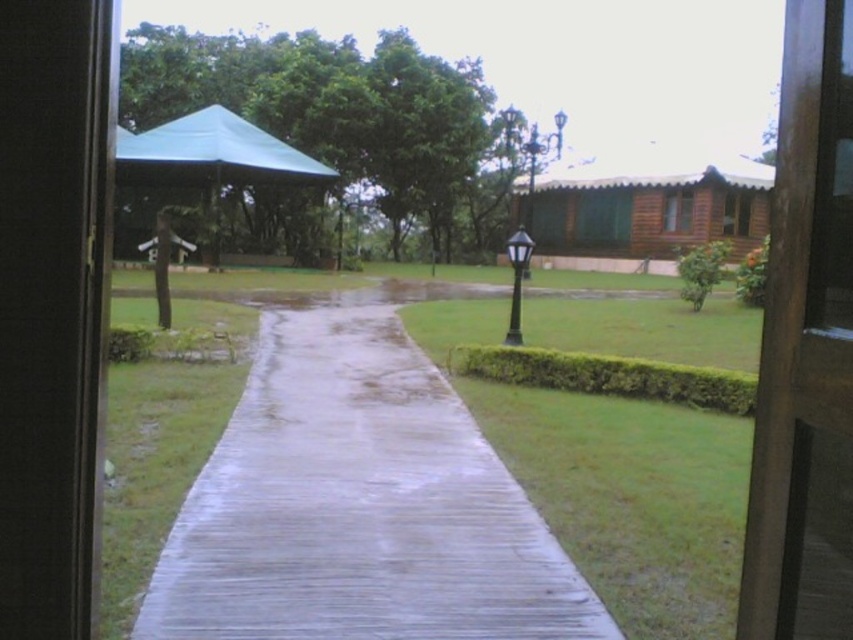
Is point (730, 636) positioned after point (291, 152)?

No, (730, 636) is in front of (291, 152).

Is green grass at center positioned behind green fabric canopy at upper left?

That is False.

Identify the location of green grass at center. This screenshot has width=853, height=640. (631, 497).

Identify the location of green grass at center. This screenshot has width=853, height=640. (631, 497).

Who is shorter, white concrete pavement at center or brown wooden hut at center?

white concrete pavement at center

Does white concrete pavement at center have a greater height compared to brown wooden hut at center?

No, white concrete pavement at center is not taller than brown wooden hut at center.

Who is more distant from viewer, (311,417) or (540,250)?

The point (540,250) is more distant.

The image size is (853, 640). Find the location of `white concrete pavement at center`. white concrete pavement at center is located at coordinates (358, 499).

Does white concrete pavement at center have a larger size compared to green grass at center?

Incorrect, white concrete pavement at center is not larger than green grass at center.

Does white concrete pavement at center have a greater height compared to green grass at center?

Incorrect, white concrete pavement at center's height is not larger of green grass at center's.

Where is `white concrete pavement at center`? Image resolution: width=853 pixels, height=640 pixels. white concrete pavement at center is located at coordinates (358, 499).

This screenshot has height=640, width=853. Find the location of `white concrete pavement at center`. white concrete pavement at center is located at coordinates (x=358, y=499).